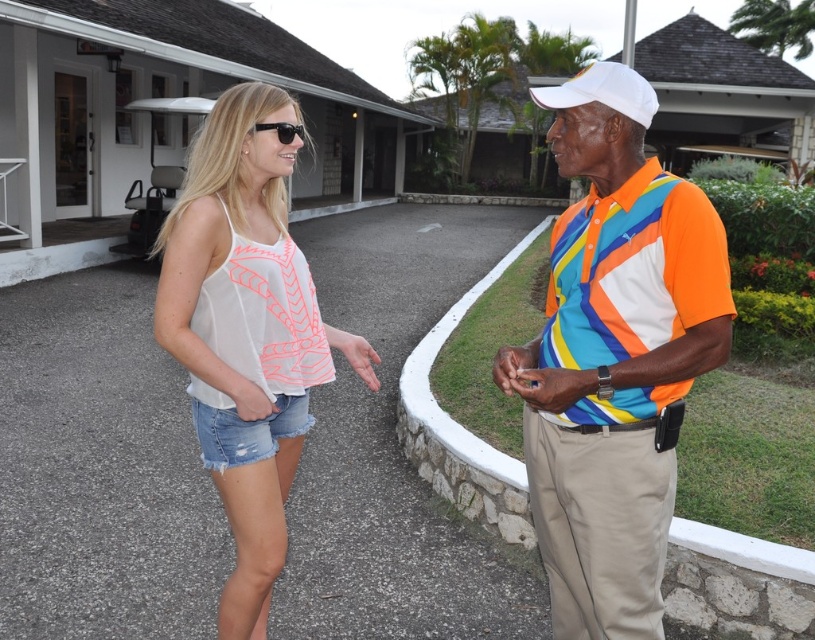
Question: Is white sheer tank top at center below white matte baseball cap at upper right?

Choices:
 (A) no
 (B) yes

Answer: (B)

Question: Which point is farther to the camera?

Choices:
 (A) orange polyester safety vest at right
 (B) white matte baseball cap at upper right

Answer: (B)

Question: Does white denim shorts at lower left appear on the right side of multicolored jersey at center?

Choices:
 (A) yes
 (B) no

Answer: (B)

Question: Is white matte baseball cap at upper right positioned in front of black plastic sunglasses at upper center?

Choices:
 (A) yes
 (B) no

Answer: (A)

Question: Which object is the closest to the white matte baseball cap at upper right?

Choices:
 (A) white denim shorts at lower left
 (B) multicolored jersey at center
 (C) white sheer tank top at center

Answer: (B)

Question: Among these objects, which one is farthest from the camera?

Choices:
 (A) white denim shorts at lower left
 (B) white matte baseball cap at upper right
 (C) denim shorts at center

Answer: (C)